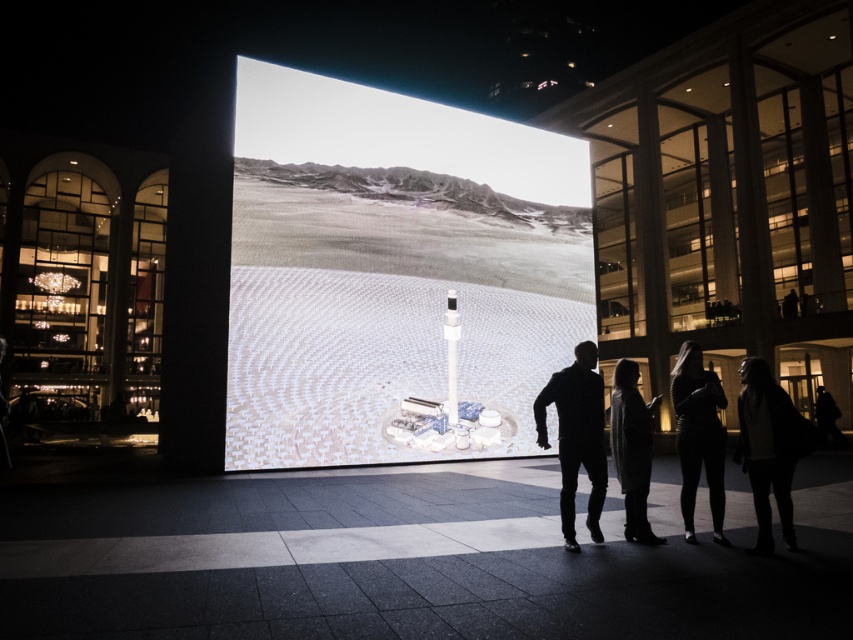
Question: Can you confirm if white glossy solar panel at center is wider than white glossy rectangular pillar at center?

Choices:
 (A) no
 (B) yes

Answer: (B)

Question: Does silhouette clothing at center come in front of black leather jacket at lower right?

Choices:
 (A) no
 (B) yes

Answer: (B)

Question: Based on their relative distances, which object is nearer to the white glossy solar panel at center?

Choices:
 (A) gray wool coat at center
 (B) white glossy rectangular pillar at center
 (C) black leather jacket at lower right

Answer: (B)

Question: Which of the following is the farthest from the observer?

Choices:
 (A) (697, 426)
 (B) (456, 410)
 (C) (640, 492)

Answer: (B)

Question: Is dark gray sweater at lower right below black matte pants at lower right?

Choices:
 (A) no
 (B) yes

Answer: (B)

Question: Which point is closer to the camera?

Choices:
 (A) dark gray sweater at lower right
 (B) silhouette clothing at center
 (C) gray wool coat at center

Answer: (A)